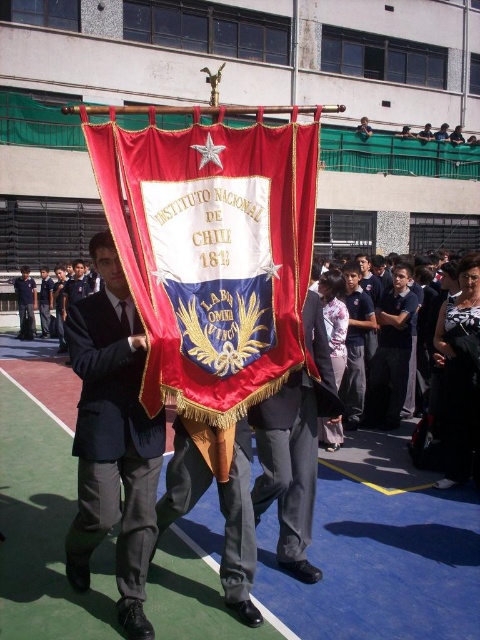
Measure the distance between point (139, 248) and camera.

Point (139, 248) is 9.56 feet away from camera.

Which is more to the right, velvet red flag at center or dark gray suit at center?

Positioned to the right is velvet red flag at center.

Where is `velvet red flag at center`? The image size is (480, 640). velvet red flag at center is located at coordinates (212, 259).

Who is more distant from viewer, (x=120, y=360) or (x=301, y=468)?

Positioned behind is point (x=301, y=468).

Who is more forward, (122,378) or (331,371)?

Point (122,378) is more forward.

The image size is (480, 640). Find the location of `dark gray suit at center`. dark gray suit at center is located at coordinates (112, 438).

Does velvet red flag at center appear on the left side of matte black pants at center?

Correct, you'll find velvet red flag at center to the left of matte black pants at center.

Does point (165, 301) lie behind point (324, 333)?

No, it is in front of (324, 333).

You are a GUI agent. You are given a task and a screenshot of the screen. Output one action in this format:
    pyautogui.click(x=<x>, y=<y>)
    Task: Click on the velvet red flag at center
    The width and height of the screenshot is (480, 640).
    Given the screenshot: What is the action you would take?
    pyautogui.click(x=212, y=259)